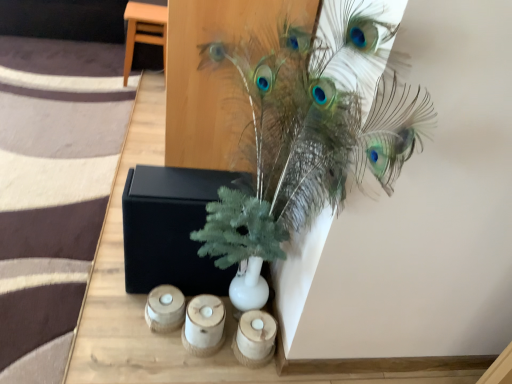
Question: From a real-world perspective, does light brown wood stool at upper left stand above green matte plant at upper center?

Choices:
 (A) no
 (B) yes

Answer: (A)

Question: From the image's perspective, does light brown wood stool at upper left appear lower than green matte plant at upper center?

Choices:
 (A) no
 (B) yes

Answer: (A)

Question: Are light brown wood stool at upper left and green matte plant at upper center making contact?

Choices:
 (A) no
 (B) yes

Answer: (A)

Question: Could green matte plant at upper center be considered to be inside light brown wood stool at upper left?

Choices:
 (A) no
 (B) yes

Answer: (A)

Question: Is the depth of light brown wood stool at upper left less than that of green matte plant at upper center?

Choices:
 (A) no
 (B) yes

Answer: (A)

Question: Does light brown wood stool at upper left have a smaller size compared to green matte plant at upper center?

Choices:
 (A) yes
 (B) no

Answer: (A)

Question: From a real-world perspective, is wooden candle holder at lower center, positioned as the first candle holder in left-to-right order, on top of wooden candle holder at lower center, which is the second candle holder from right to left?

Choices:
 (A) yes
 (B) no

Answer: (B)

Question: Is wooden candle holder at lower center, which is the third candle holder from right to left, aimed at wooden candle holder at lower center, which is the second candle holder from right to left?

Choices:
 (A) no
 (B) yes

Answer: (A)

Question: Is the depth of wooden candle holder at lower center, positioned as the first candle holder in left-to-right order, greater than that of wooden candle holder at lower center, which is the second candle holder from right to left?

Choices:
 (A) no
 (B) yes

Answer: (B)

Question: Does wooden candle holder at lower center, positioned as the first candle holder in left-to-right order, appear on the right side of wooden candle holder at lower center, the 2th candle holder viewed from the left?

Choices:
 (A) no
 (B) yes

Answer: (A)

Question: Does wooden candle holder at lower center, positioned as the first candle holder in left-to-right order, have a greater width compared to wooden candle holder at lower center, which is the second candle holder from right to left?

Choices:
 (A) yes
 (B) no

Answer: (B)

Question: Is there a large distance between wooden candle holder at lower center, positioned as the first candle holder in left-to-right order, and wooden candle holder at lower center, the 2th candle holder viewed from the left?

Choices:
 (A) no
 (B) yes

Answer: (A)

Question: From the image's perspective, would you say black matte box at center is positioned over light brown wood stool at upper left?

Choices:
 (A) no
 (B) yes

Answer: (A)